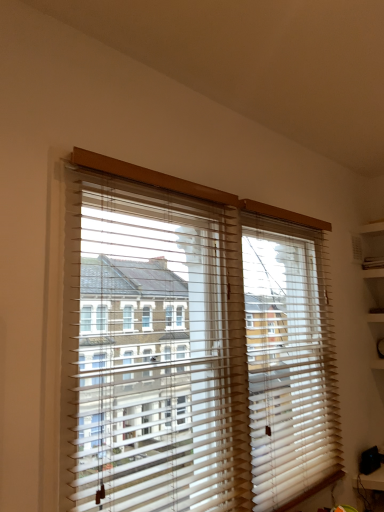
This screenshot has width=384, height=512. Identify the location of white plastic blinds at center. (192, 347).

What do you see at coordinates (192, 347) in the screenshot? Image resolution: width=384 pixels, height=512 pixels. I see `white plastic blinds at center` at bounding box center [192, 347].

The image size is (384, 512). I want to click on white plastic blinds at center, so click(x=192, y=347).